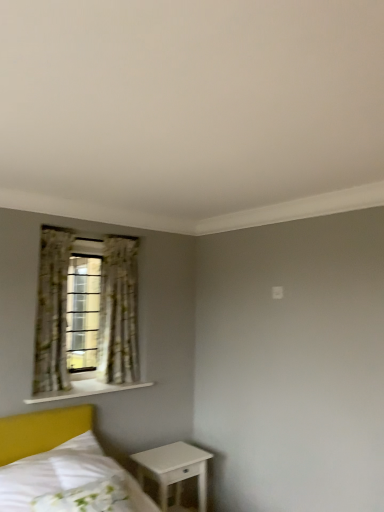
Question: Does point (152, 470) appear closer or farther from the camera than point (44, 316)?

Choices:
 (A) farther
 (B) closer

Answer: (B)

Question: Is white glossy nightstand at lower right inside or outside of floral fabric curtain at left, marked as the 1th curtain in a left-to-right arrangement?

Choices:
 (A) inside
 (B) outside

Answer: (B)

Question: Estimate the real-world distances between objects in this image. Which object is farther from the floral fabric curtain at left?

Choices:
 (A) white wooden shelf at lower left
 (B) white floral fabric pillow at lower left
 (C) floral fabric curtain at left, which is counted as the 2th curtain, starting from the left
 (D) floral fabric curtain at left, the second curtain viewed from the right
 (E) white glossy nightstand at lower right

Answer: (B)

Question: Which of these objects is positioned farthest from the white wooden shelf at lower left?

Choices:
 (A) white floral fabric pillow at lower left
 (B) floral fabric curtain at left
 (C) floral fabric curtain at left, the second curtain viewed from the right
 (D) floral fabric curtain at left, the first curtain viewed from the right
 (E) white glossy nightstand at lower right

Answer: (A)